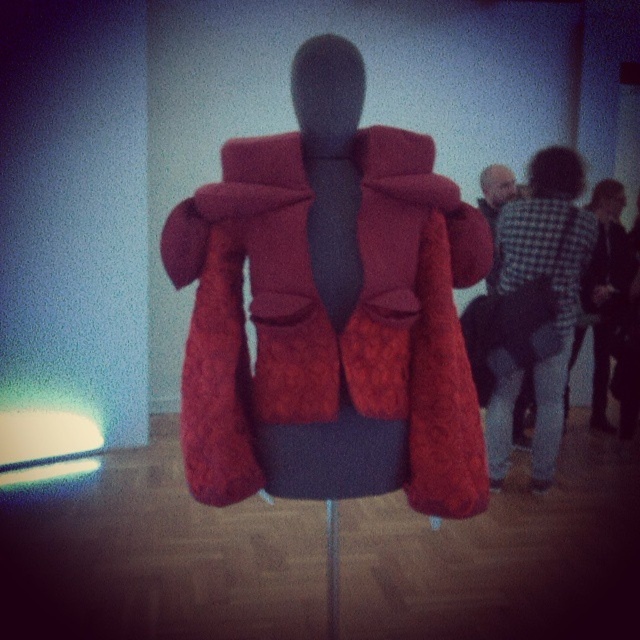
Who is lower down, checkered fabric shirt at center or black checkered shirt at upper right?

black checkered shirt at upper right

Is point (548, 403) positioned behind point (602, 195)?

No, it is not.

Where is `checkered fabric shirt at center`? The width and height of the screenshot is (640, 640). checkered fabric shirt at center is located at coordinates (550, 282).

Who is higher up, velvet red coat at center or black checkered shirt at upper right?

velvet red coat at center

Does velvet red coat at center come behind black checkered shirt at upper right?

No, it is in front of black checkered shirt at upper right.

Which is in front, point (307, 65) or point (620, 294)?

Point (307, 65) is more forward.

This screenshot has height=640, width=640. Identify the location of velvet red coat at center. (330, 308).

What do you see at coordinates (330, 308) in the screenshot? The width and height of the screenshot is (640, 640). I see `velvet red coat at center` at bounding box center [330, 308].

Consider the image. Is velvet red coat at center thinner than checkered fabric shirt at center?

No.

The width and height of the screenshot is (640, 640). In order to click on velvet red coat at center in this screenshot , I will do `click(330, 308)`.